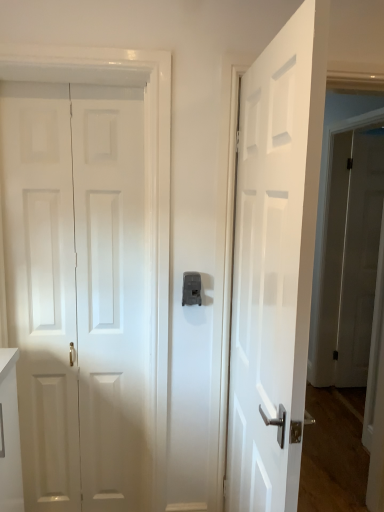
Image resolution: width=384 pixels, height=512 pixels. What do you see at coordinates (191, 288) in the screenshot?
I see `matte gray latch at center` at bounding box center [191, 288].

What do you see at coordinates (360, 257) in the screenshot? Image resolution: width=384 pixels, height=512 pixels. I see `white glossy door at right, the first door from the right` at bounding box center [360, 257].

Locate an element on the screen. This screenshot has width=384, height=512. white matte door at left, which ranks as the 3th door in right-to-left order is located at coordinates (77, 289).

Locate an element on the screen. This screenshot has width=384, height=512. matte gray latch at center is located at coordinates (191, 288).

Is white glossy door at right, the first door from the right, in contact with matte gray latch at center?

No, white glossy door at right, the first door from the right, is not next to matte gray latch at center.

Could you tell me if white glossy door at right, placed as the 1th door when sorted from back to front, is turned towards matte gray latch at center?

No, white glossy door at right, placed as the 1th door when sorted from back to front, is not facing towards matte gray latch at center.

Can you confirm if white glossy door at right, the first door from the right, is thinner than matte gray latch at center?

No.

From the image's perspective, between white glossy door at right, which ranks as the 3th door in left-to-right order, and matte gray latch at center, which one is located above?

white glossy door at right, which ranks as the 3th door in left-to-right order, appears higher in the image.

Are white glossy door at center, which is the first door from front to back, and white glossy door at right, placed as the 1th door when sorted from back to front, far apart?

Yes, white glossy door at center, which is the first door from front to back, and white glossy door at right, placed as the 1th door when sorted from back to front, are located far from each other.

From the image's perspective, which door is the 2nd one below the white glossy door at right, the first door from the right? Please provide its 2D coordinates.

[(274, 265)]

Between white glossy door at center, the 2th door viewed from the left, and white glossy door at right, which ranks as the 3th door in left-to-right order, which one has smaller size?

white glossy door at right, which ranks as the 3th door in left-to-right order, is smaller.

Considering the relative sizes of white glossy door at center, the 2th door from the right, and white glossy door at right, the first door from the right, in the image provided, is white glossy door at center, the 2th door from the right, thinner than white glossy door at right, the first door from the right,?

In fact, white glossy door at center, the 2th door from the right, might be wider than white glossy door at right, the first door from the right.

The image size is (384, 512). I want to click on door that appears on the left of white glossy door at center, the 2th door viewed from the left, so pos(77,289).

In the scene shown: Is white glossy door at center, the 3th door positioned from the back, at the back of white matte door at left, marked as the second door in a back-to-front arrangement?

That's not correct — white matte door at left, marked as the second door in a back-to-front arrangement, is not looking away from white glossy door at center, the 3th door positioned from the back.

In terms of size, does white matte door at left, positioned as the first door in left-to-right order, appear bigger or smaller than white glossy door at center, which is the first door from front to back?

Considering their sizes, white matte door at left, positioned as the first door in left-to-right order, takes up less space than white glossy door at center, which is the first door from front to back.

Is white matte door at left, marked as the second door in a back-to-front arrangement, in front of or behind white glossy door at center, the 2th door from the right, in the image?

Clearly, white matte door at left, marked as the second door in a back-to-front arrangement, is behind white glossy door at center, the 2th door from the right.

Is the depth of white matte door at left, marked as the second door in a back-to-front arrangement, less than that of white glossy door at right, the first door from the right?

Yes, white matte door at left, marked as the second door in a back-to-front arrangement, is closer to the camera.

Can you confirm if white matte door at left, positioned as the first door in left-to-right order, is bigger than white glossy door at right, positioned as the 3th door in front-to-back order?

Actually, white matte door at left, positioned as the first door in left-to-right order, might be smaller than white glossy door at right, positioned as the 3th door in front-to-back order.

Between white matte door at left, positioned as the 2th door in front-to-back order, and white glossy door at right, positioned as the 3th door in front-to-back order, which one has more height?

white glossy door at right, positioned as the 3th door in front-to-back order.

Is white matte door at left, positioned as the 2th door in front-to-back order, far from white glossy door at right, positioned as the 3th door in front-to-back order?

white matte door at left, positioned as the 2th door in front-to-back order, is positioned a significant distance from white glossy door at right, positioned as the 3th door in front-to-back order.

Looking at this image, considering the positions of objects white glossy door at right, the first door from the right, and white glossy door at center, the 2th door from the right, in the image provided, who is more to the left, white glossy door at right, the first door from the right, or white glossy door at center, the 2th door from the right,?

white glossy door at center, the 2th door from the right.

Looking at this image, from the image's perspective, is white glossy door at right, placed as the 1th door when sorted from back to front, above white glossy door at center, the 3th door positioned from the back?

Yes, from the image's perspective, white glossy door at right, placed as the 1th door when sorted from back to front, is above white glossy door at center, the 3th door positioned from the back.

From a real-world perspective, which object rests below the other?

white glossy door at right, the first door from the right.

Is white glossy door at right, which ranks as the 3th door in left-to-right order, bigger or smaller than white glossy door at center, the 2th door from the right?

Clearly, white glossy door at right, which ranks as the 3th door in left-to-right order, is smaller in size than white glossy door at center, the 2th door from the right.

Is white glossy door at center, the 3th door positioned from the back, bigger or smaller than matte gray latch at center?

In the image, white glossy door at center, the 3th door positioned from the back, appears to be larger than matte gray latch at center.

From a real-world perspective, relative to matte gray latch at center, is white glossy door at center, which is the first door from front to back, vertically above or below?

Clearly, from a real-world perspective, white glossy door at center, which is the first door from front to back, is below matte gray latch at center.

Is white glossy door at center, the 3th door positioned from the back, located outside matte gray latch at center?

Yes, white glossy door at center, the 3th door positioned from the back, is not within matte gray latch at center.

Could you measure the distance between white glossy door at center, the 3th door positioned from the back, and matte gray latch at center?

They are 20.66 inches apart.

Based on the photo, from the image's perspective, who appears lower, matte gray latch at center or white glossy door at right, the first door from the right?

From the image's view, matte gray latch at center is below.

Is matte gray latch at center oriented away from white glossy door at right, placed as the 1th door when sorted from back to front?

No, matte gray latch at center is not facing the opposite direction of white glossy door at right, placed as the 1th door when sorted from back to front.

From a real-world perspective, which object stands above the other?

matte gray latch at center, from a real-world perspective.

Considering the positions of objects matte gray latch at center and white glossy door at right, which ranks as the 3th door in left-to-right order, in the image provided, who is more to the left, matte gray latch at center or white glossy door at right, which ranks as the 3th door in left-to-right order,?

matte gray latch at center.

At what (x,y) coordinates should I click in order to perform the action: click on latch in front of the white glossy door at right, the first door from the right. Please return your answer as a coordinate pair (x, y). This screenshot has height=512, width=384. Looking at the image, I should click on (191, 288).

There is a white glossy door at center, which is the first door from front to back. At what (x,y) coordinates should I click in order to perform the action: click on the 2nd door above it (from the image's perspective). Please return your answer as a coordinate pair (x, y). The height and width of the screenshot is (512, 384). Looking at the image, I should click on (360, 257).

Considering their positions, is white matte door at left, which ranks as the 3th door in right-to-left order, positioned further to white glossy door at right, positioned as the 3th door in front-to-back order, than matte gray latch at center?

white matte door at left, which ranks as the 3th door in right-to-left order, is further to white glossy door at right, positioned as the 3th door in front-to-back order.

Considering their positions, is white glossy door at center, the 2th door from the right, positioned further to white matte door at left, positioned as the first door in left-to-right order, than white glossy door at right, which ranks as the 3th door in left-to-right order?

white glossy door at right, which ranks as the 3th door in left-to-right order, lies further to white matte door at left, positioned as the first door in left-to-right order, than the other object.

From the image, which object appears to be nearer to white glossy door at right, the first door from the right, matte gray latch at center or white matte door at left, positioned as the 2th door in front-to-back order?

matte gray latch at center is closer to white glossy door at right, the first door from the right.

Based on their spatial positions, is white glossy door at right, positioned as the 3th door in front-to-back order, or white glossy door at center, the 2th door from the right, closer to matte gray latch at center?

Based on the image, white glossy door at center, the 2th door from the right, appears to be nearer to matte gray latch at center.

Estimate the real-world distances between objects in this image. Which object is further from white matte door at left, which ranks as the 3th door in right-to-left order, white glossy door at right, which ranks as the 3th door in left-to-right order, or matte gray latch at center?

white glossy door at right, which ranks as the 3th door in left-to-right order, is positioned further to the anchor white matte door at left, which ranks as the 3th door in right-to-left order.

Looking at the image, which one is located closer to matte gray latch at center, white glossy door at center, the 2th door from the right, or white matte door at left, marked as the second door in a back-to-front arrangement?

The object closer to matte gray latch at center is white glossy door at center, the 2th door from the right.

Estimate the real-world distances between objects in this image. Which object is further from white glossy door at right, the first door from the right, white glossy door at center, which is the first door from front to back, or white matte door at left, which ranks as the 3th door in right-to-left order?

white matte door at left, which ranks as the 3th door in right-to-left order, lies further to white glossy door at right, the first door from the right, than the other object.

From the image, which object appears to be nearer to white glossy door at right, placed as the 1th door when sorted from back to front, white matte door at left, marked as the second door in a back-to-front arrangement, or white glossy door at center, the 2th door from the right?

white glossy door at center, the 2th door from the right.

The image size is (384, 512). What are the coordinates of `latch located between white matte door at left, positioned as the 2th door in front-to-back order, and white glossy door at right, which ranks as the 3th door in left-to-right order, in the left-right direction` in the screenshot? It's located at (191, 288).

At what (x,y) coordinates should I click in order to perform the action: click on door between white glossy door at center, the 2th door from the right, and white glossy door at right, positioned as the 3th door in front-to-back order, along the z-axis. Please return your answer as a coordinate pair (x, y). Looking at the image, I should click on (77, 289).

Where is `door between white glossy door at center, the 2th door viewed from the left, and matte gray latch at center in the front-back direction`? The height and width of the screenshot is (512, 384). door between white glossy door at center, the 2th door viewed from the left, and matte gray latch at center in the front-back direction is located at coordinates (77, 289).

I want to click on latch between white glossy door at center, the 2th door from the right, and white glossy door at right, positioned as the 3th door in front-to-back order, in the front-back direction, so click(191, 288).